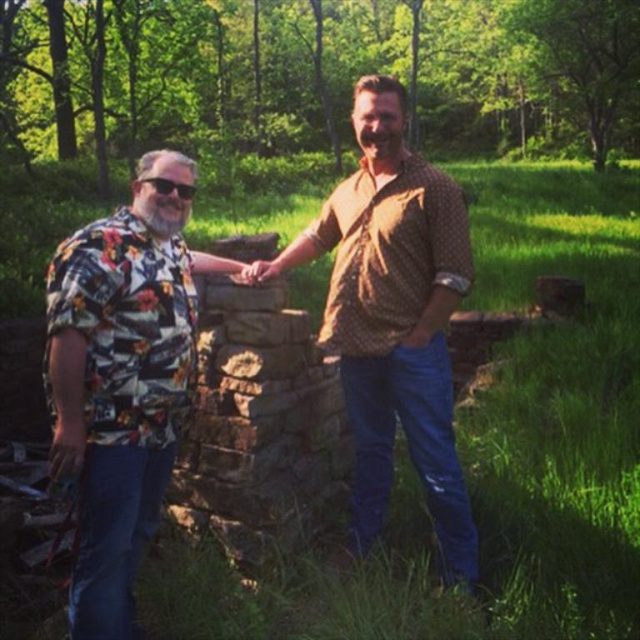
Question: Which point is closer to the camera taking this photo?

Choices:
 (A) (77, 545)
 (B) (378, 104)
 (C) (419, 417)

Answer: (A)

Question: Is floral print shirt at left further to the viewer compared to brown dotted shirt at center?

Choices:
 (A) yes
 (B) no

Answer: (B)

Question: Is floral print shirt at left closer to camera compared to brown dotted shirt at center?

Choices:
 (A) yes
 (B) no

Answer: (A)

Question: Which point is closer to the camera taking this photo?

Choices:
 (A) (84, 244)
 (B) (433, 202)

Answer: (A)

Question: Can you confirm if floral-patterned shirt at center is positioned to the right of brown dotted shirt at center?

Choices:
 (A) no
 (B) yes

Answer: (A)

Question: Which of the following is the farthest from the observer?

Choices:
 (A) (339, 342)
 (B) (144, 340)
 (C) (378, 394)

Answer: (C)